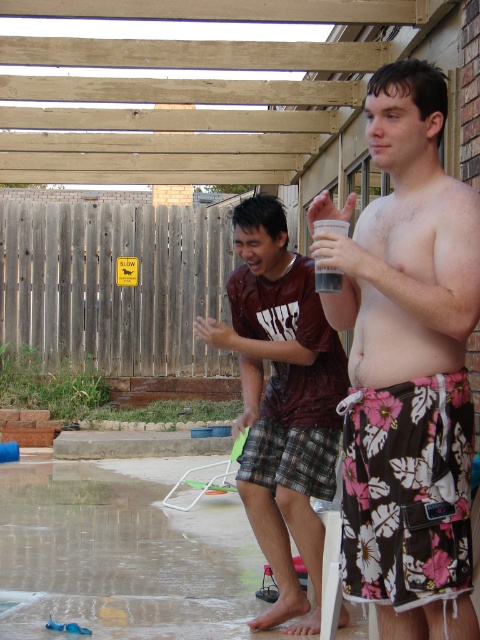
You are a photographer trying to capture a candid shot of both the floral swim trunks at center and the brown plaid shorts at center. Since you want to include both in the frame, which direction should you position yourself relative to the subjects to ensure both are visible?

You should position yourself to the left of the subjects because the floral swim trunks at center is to the right of the brown plaid shorts at center, so facing them from the left side would allow both to be within the camera frame.

You are a photographer taking a picture of the two people in the scene. To ensure both the floral swim trunks at center and the brown plaid shorts at center are clearly visible in the photo, which one should you focus on first?

You should focus on the floral swim trunks at center first because it is in front of the brown plaid shorts at center, so focusing on the front object ensures both will be in focus.